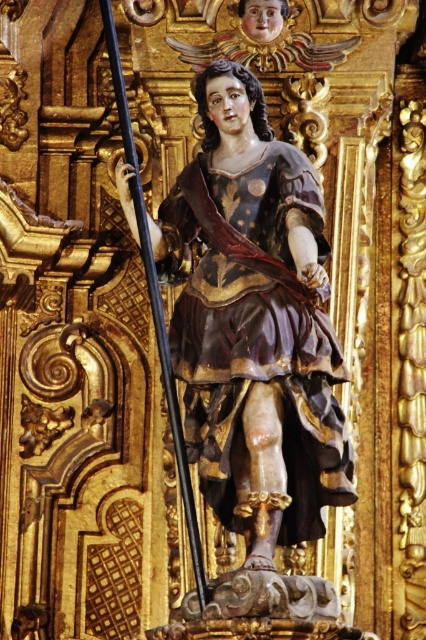
Question: Does wooden statue at center have a larger size compared to black polished wood pole at center?

Choices:
 (A) no
 (B) yes

Answer: (A)

Question: Where is wooden statue at center located in relation to black polished wood pole at center in the image?

Choices:
 (A) right
 (B) left

Answer: (A)

Question: Among these points, which one is nearest to the camera?

Choices:
 (A) (324, 413)
 (B) (183, 461)

Answer: (B)

Question: Is wooden statue at center smaller than black polished wood pole at center?

Choices:
 (A) no
 (B) yes

Answer: (B)

Question: Which point is farther from the camera taking this photo?

Choices:
 (A) (284, 403)
 (B) (164, 364)

Answer: (B)